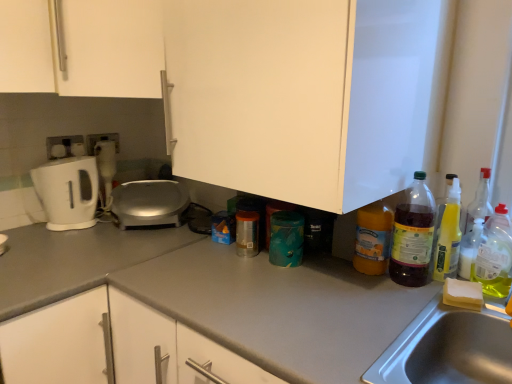
Question: Is clear plastic bottle at right, which is the first bottle from right to left, far from satin silver appliance at center?

Choices:
 (A) yes
 (B) no

Answer: (A)

Question: From a real-world perspective, is clear plastic bottle at right, positioned as the fifth bottle in left-to-right order, physically above satin silver appliance at center?

Choices:
 (A) no
 (B) yes

Answer: (B)

Question: From the image's perspective, is clear plastic bottle at right, positioned as the fifth bottle in left-to-right order, below satin silver appliance at center?

Choices:
 (A) yes
 (B) no

Answer: (A)

Question: Is clear plastic bottle at right, which is the first bottle from right to left, oriented away from satin silver appliance at center?

Choices:
 (A) yes
 (B) no

Answer: (B)

Question: Can you confirm if clear plastic bottle at right, positioned as the fifth bottle in left-to-right order, is positioned to the left of satin silver appliance at center?

Choices:
 (A) yes
 (B) no

Answer: (B)

Question: Is clear plastic bottle at right, which is the first bottle from right to left, outside satin silver appliance at center?

Choices:
 (A) yes
 (B) no

Answer: (A)

Question: Is gray matte countertop at center bigger than yellow translucent spray bottle at right, which ranks as the fourth bottle in left-to-right order?

Choices:
 (A) no
 (B) yes

Answer: (B)

Question: From the image's perspective, is gray matte countertop at center below yellow translucent spray bottle at right, which ranks as the fourth bottle in left-to-right order?

Choices:
 (A) no
 (B) yes

Answer: (B)

Question: Is gray matte countertop at center not inside yellow translucent spray bottle at right, which is the second bottle from right to left?

Choices:
 (A) no
 (B) yes

Answer: (B)

Question: Is gray matte countertop at center to the left of yellow translucent spray bottle at right, which is the second bottle from right to left, from the viewer's perspective?

Choices:
 (A) no
 (B) yes

Answer: (B)

Question: Is gray matte countertop at center surrounding yellow translucent spray bottle at right, which is the second bottle from right to left?

Choices:
 (A) no
 (B) yes

Answer: (A)

Question: Is gray matte countertop at center wider than yellow translucent spray bottle at right, which ranks as the fourth bottle in left-to-right order?

Choices:
 (A) yes
 (B) no

Answer: (A)

Question: Is translucent plastic spray bottle at right, the third bottle in the right-to-left sequence, smaller than yellow translucent spray bottle at right, which is the second bottle from right to left?

Choices:
 (A) yes
 (B) no

Answer: (B)